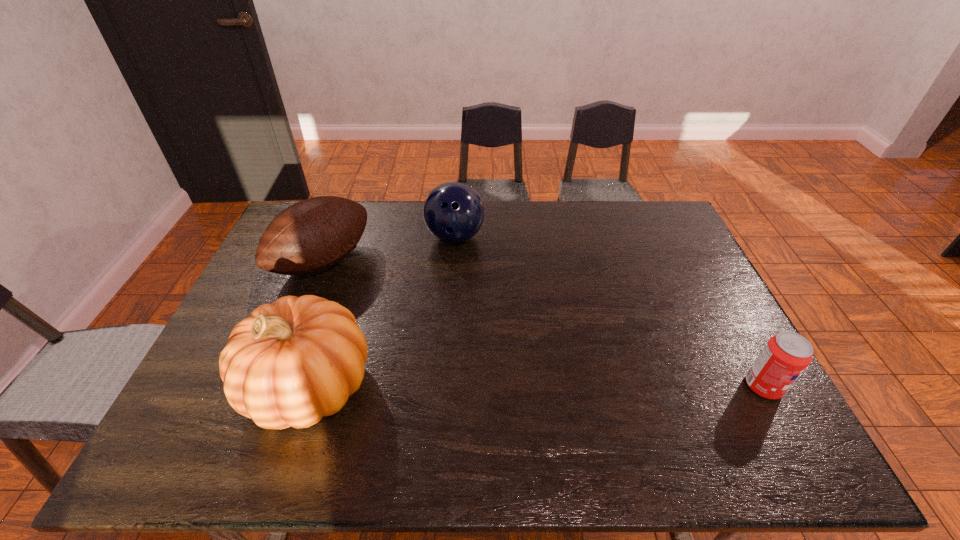
Identify the location of object at the near left corner. (290, 363).

Image resolution: width=960 pixels, height=540 pixels. Find the location of `object that is at the near right corner`. object that is at the near right corner is located at coordinates (786, 355).

In the image, there is a desktop. Where is `blank space at the far edge`? This screenshot has width=960, height=540. blank space at the far edge is located at coordinates (385, 240).

In the image, there is a desktop. Identify the location of vacant space at the near edge. This screenshot has width=960, height=540. (468, 400).

The height and width of the screenshot is (540, 960). Identify the location of vacant space at the left edge. (303, 287).

Identify the location of free space at the right edge of the desktop. Image resolution: width=960 pixels, height=540 pixels. 695,305.

In order to click on vacant area between the tallest object and the soda can in this screenshot , I will do `click(537, 386)`.

Image resolution: width=960 pixels, height=540 pixels. I want to click on free spot between the third object from left to right and the tallest object, so click(x=382, y=312).

Locate an element on the screen. unoccupied position between the third object from left to right and the tallest object is located at coordinates click(382, 312).

You are a GUI agent. You are given a task and a screenshot of the screen. Output one action in this format:
    pyautogui.click(x=<x>, y=<y>)
    Task: Click on the free space between the football and the soda can
    
    Given the screenshot: What is the action you would take?
    pyautogui.click(x=543, y=324)